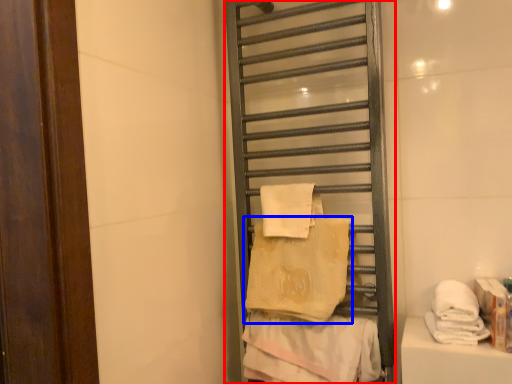
Question: Which point is closer to the camera, shelf (highlighted by a red box) or towel (highlighted by a blue box)?

Choices:
 (A) shelf
 (B) towel

Answer: (A)